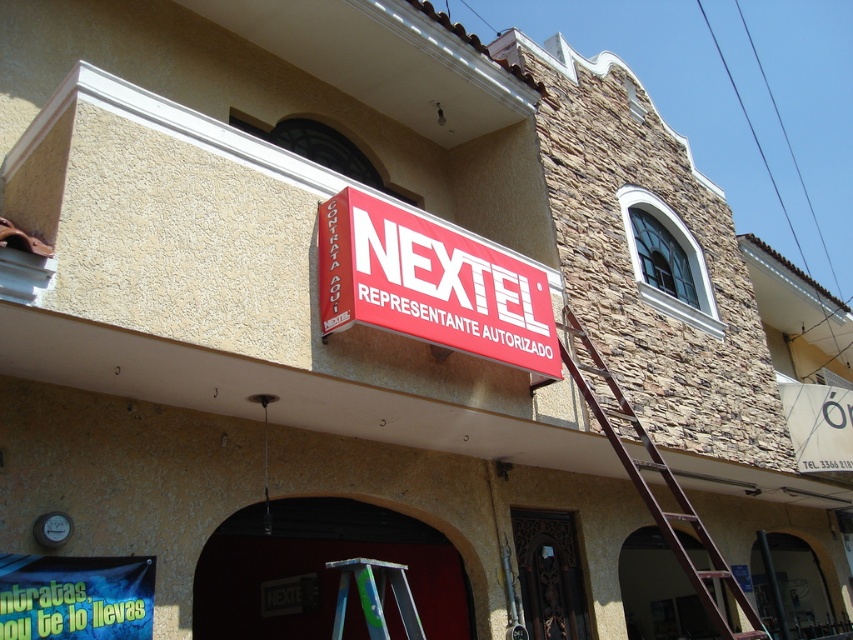
Question: Which object is the closest to the red plastic sign at center?

Choices:
 (A) silver metallic ladder at center
 (B) brown wooden ladder at right

Answer: (B)

Question: Does brown wooden ladder at right come in front of silver metallic ladder at center?

Choices:
 (A) no
 (B) yes

Answer: (A)

Question: Which of the following is the farthest from the observer?

Choices:
 (A) (618, 451)
 (B) (349, 563)
 (C) (321, 320)

Answer: (A)

Question: Is red plastic sign at center closer to camera compared to brown wooden ladder at right?

Choices:
 (A) yes
 (B) no

Answer: (A)

Question: Among these objects, which one is farthest from the camera?

Choices:
 (A) silver metallic ladder at center
 (B) brown wooden ladder at right
 (C) red plastic sign at center

Answer: (B)

Question: Can you confirm if brown wooden ladder at right is positioned to the right of silver metallic ladder at center?

Choices:
 (A) yes
 (B) no

Answer: (A)